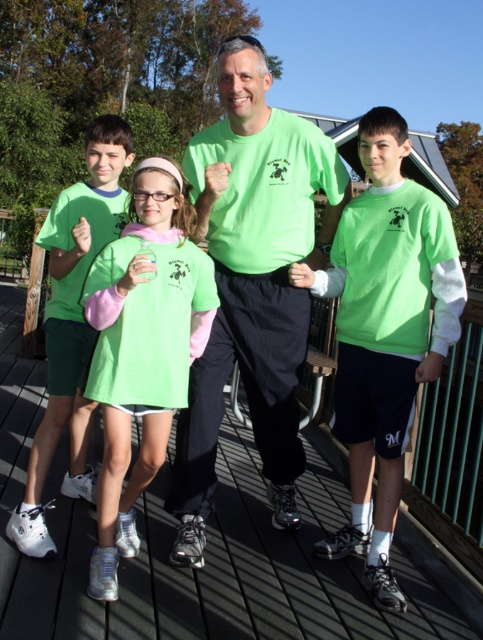
You are standing in front of the image and want to touch the two points shown in the scene. Which point, point (372, 352) or point (46, 236), is closer to your hand when you reach out?

Point (372, 352) is closer to the camera, so it would be closer to your hand when reaching out.

You are a photographer trying to capture a group photo of the matte green shirt at right and the matte green shorts at center. If you want to ensure both are visible in the frame, which direction should you position your camera relative to the subjects?

The matte green shirt at right is positioned on the right side of the matte green shorts at center. To capture both in the frame, position the camera to the left side of the subjects so that both the right and center positions are included.